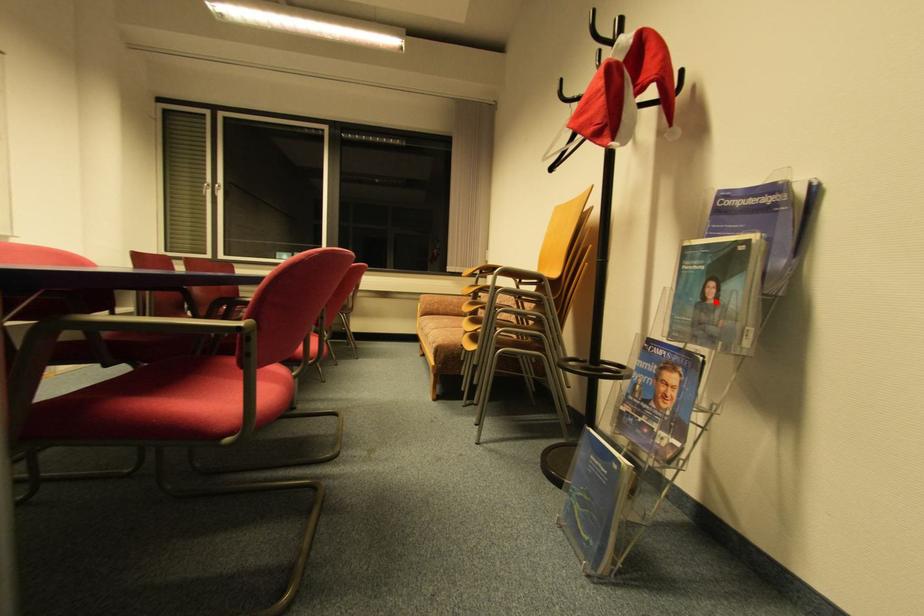
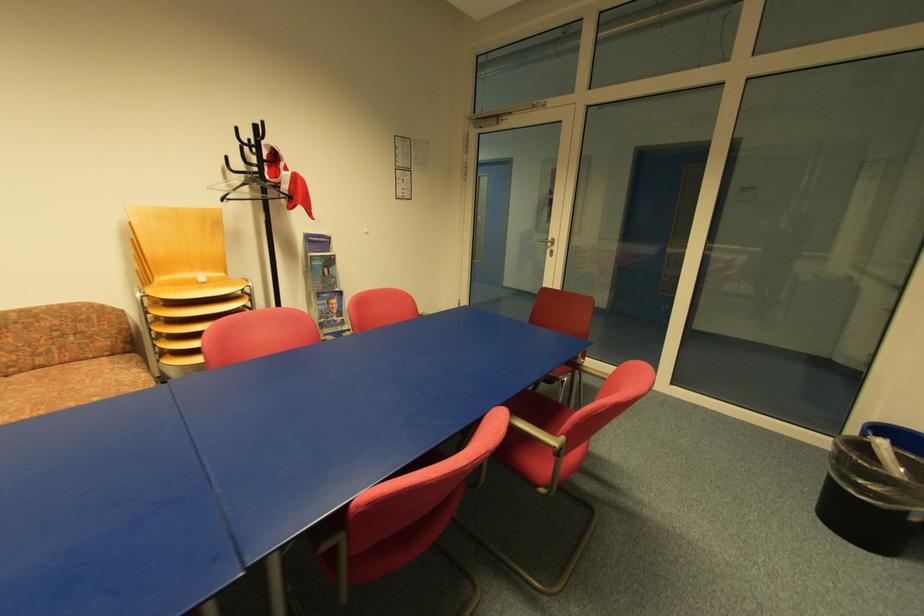
Locate, in the second image, the point that corresponds to the highlighted location in the first image.

(331, 275)